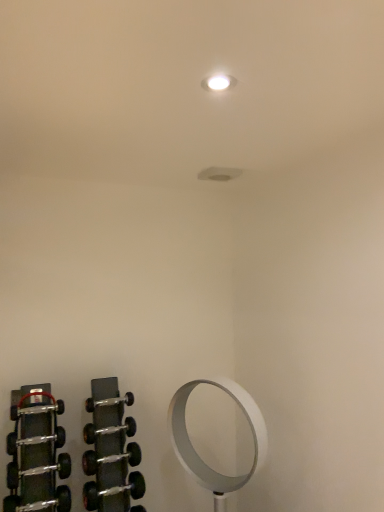
Question: From a real-world perspective, is polished silver dumbbell at lower left, the seventh dumbbell in the bottom-to-top sequence, located beneath white metallic mirror at lower right?

Choices:
 (A) no
 (B) yes

Answer: (A)

Question: Considering the relative sizes of polished silver dumbbell at lower left, the seventh dumbbell in the bottom-to-top sequence, and white metallic mirror at lower right in the image provided, is polished silver dumbbell at lower left, the seventh dumbbell in the bottom-to-top sequence, smaller than white metallic mirror at lower right?

Choices:
 (A) no
 (B) yes

Answer: (B)

Question: Is polished silver dumbbell at lower left, the 2th dumbbell when ordered from top to bottom, closer to camera compared to white metallic mirror at lower right?

Choices:
 (A) no
 (B) yes

Answer: (A)

Question: Is there a large distance between polished silver dumbbell at lower left, the 2th dumbbell when ordered from top to bottom, and white metallic mirror at lower right?

Choices:
 (A) no
 (B) yes

Answer: (A)

Question: Can you confirm if polished silver dumbbell at lower left, the 2th dumbbell when ordered from top to bottom, is bigger than white metallic mirror at lower right?

Choices:
 (A) yes
 (B) no

Answer: (B)

Question: Considering the positions of point (49, 499) and point (41, 409), is point (49, 499) closer or farther from the camera than point (41, 409)?

Choices:
 (A) farther
 (B) closer

Answer: (A)

Question: Considering the positions of black rubber dumbbell at lower left, which is the 7th dumbbell in top-to-bottom order, and polished metal dumbbell at left, the eighth dumbbell from the bottom, in the image, is black rubber dumbbell at lower left, which is the 7th dumbbell in top-to-bottom order, bigger or smaller than polished metal dumbbell at left, the eighth dumbbell from the bottom,?

Choices:
 (A) small
 (B) big

Answer: (B)

Question: From the image's perspective, is black rubber dumbbell at lower left, the second dumbbell when ordered from bottom to top, positioned above or below polished metal dumbbell at left, the 1th dumbbell positioned from the top?

Choices:
 (A) below
 (B) above

Answer: (A)

Question: In the image, is black rubber dumbbell at lower left, which is the 7th dumbbell in top-to-bottom order, positioned in front of or behind polished metal dumbbell at left, the 1th dumbbell positioned from the top?

Choices:
 (A) behind
 (B) front

Answer: (B)

Question: Considering their positions, is silver metallic dumbbell at lower left, placed as the 8th dumbbell when sorted from top to bottom, located in front of or behind silver metallic dumbbell at lower left, marked as the 5th dumbbell in a top-to-bottom arrangement?

Choices:
 (A) front
 (B) behind

Answer: (B)

Question: From the image's perspective, is silver metallic dumbbell at lower left, placed as the 8th dumbbell when sorted from top to bottom, above or below silver metallic dumbbell at lower left, marked as the 5th dumbbell in a top-to-bottom arrangement?

Choices:
 (A) below
 (B) above

Answer: (A)

Question: Looking at the image, does silver metallic dumbbell at lower left, placed as the 8th dumbbell when sorted from top to bottom, seem bigger or smaller compared to silver metallic dumbbell at lower left, acting as the fourth dumbbell starting from the bottom?

Choices:
 (A) small
 (B) big

Answer: (B)

Question: Is silver metallic dumbbell at lower left, the first dumbbell in the bottom-to-top sequence, inside the boundaries of silver metallic dumbbell at lower left, acting as the fourth dumbbell starting from the bottom, or outside?

Choices:
 (A) outside
 (B) inside

Answer: (A)

Question: In the image, is silver metallic dumbbell at lower left, the first dumbbell in the bottom-to-top sequence, positioned in front of or behind polished silver dumbbell at lower left, the 2th dumbbell when ordered from top to bottom?

Choices:
 (A) front
 (B) behind

Answer: (A)

Question: From a real-world perspective, is silver metallic dumbbell at lower left, the first dumbbell in the bottom-to-top sequence, above or below polished silver dumbbell at lower left, the seventh dumbbell in the bottom-to-top sequence?

Choices:
 (A) above
 (B) below

Answer: (B)